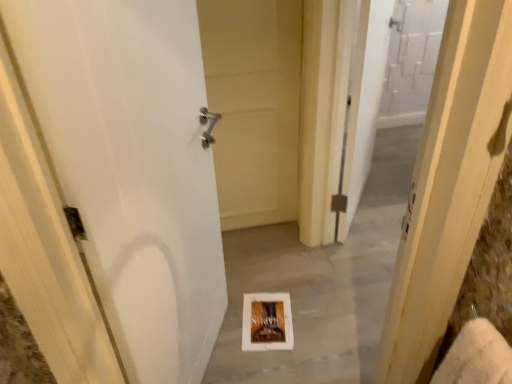
Locate an element on the screen. free region under white cardboard book at center (from a real-world perspective) is located at coordinates (263, 314).